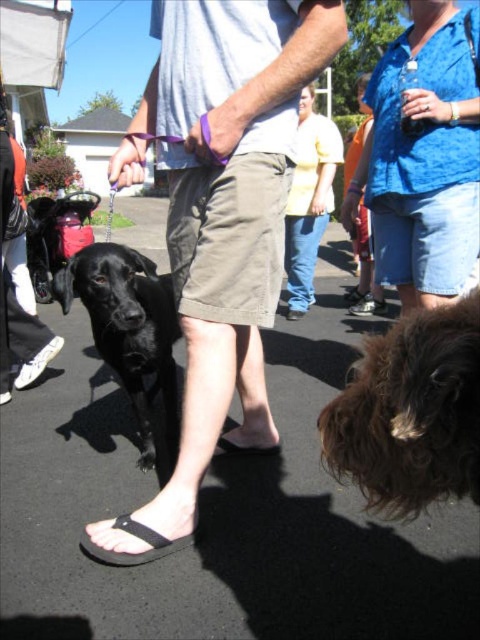
Question: Does black matte shorts at center have a greater width compared to curly brown fur at lower right?

Choices:
 (A) yes
 (B) no

Answer: (A)

Question: Which point is closer to the camera?

Choices:
 (A) curly brown fur at lower right
 (B) black flip-flop at lower center

Answer: (A)

Question: Can you confirm if curly brown fur at lower right is positioned to the left of shiny black dog at lower left?

Choices:
 (A) no
 (B) yes

Answer: (A)

Question: Based on their relative distances, which object is nearer to the blue denim shorts at upper right?

Choices:
 (A) shiny black dog at lower left
 (B) black flip-flop at lower center
 (C) black matte shorts at center
 (D) yellow cotton shirt at center

Answer: (C)

Question: Which point is farther from the camera taking this photo?

Choices:
 (A) (96, 257)
 (B) (240, 150)
 (C) (429, 42)

Answer: (C)

Question: Can you confirm if curly brown fur at lower right is positioned to the left of yellow cotton shirt at center?

Choices:
 (A) yes
 (B) no

Answer: (A)